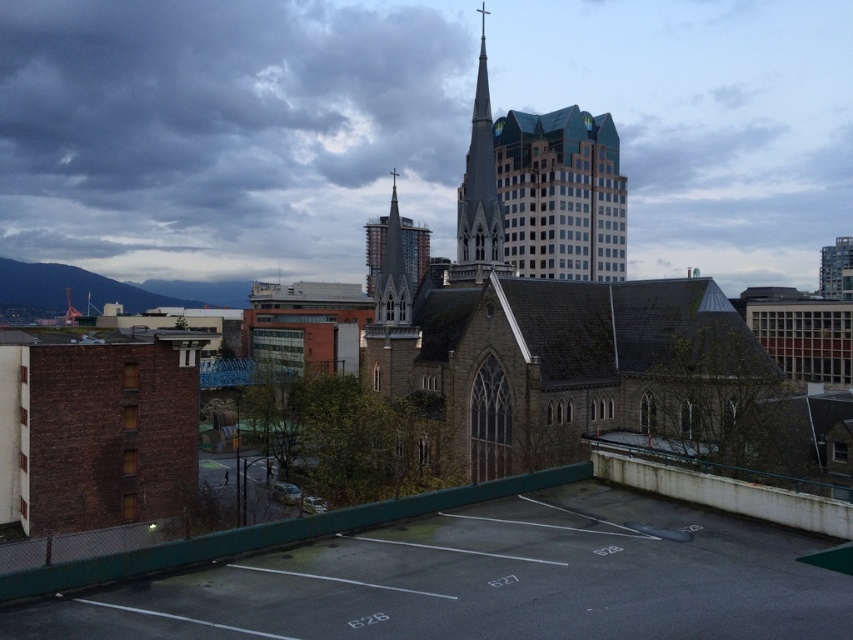
You are a city planner assessing the space between two structures in the image. The gray stone spire at center and the dark gray stone tower at center are both part of the church complex. You need to install a temporary walkway between them for maintenance. The walkway requires a minimum clearance of 100 feet between the two structures. Based on the scene description, will the existing space between them allow for this installation?

The gray stone spire at center is 100.75 feet from the dark gray stone tower at center. Since the required clearance is 100 feet, the existing space of 100.75 feet is sufficient to accommodate the temporary walkway between them.

You are standing at the center of the parking lot and want to take a photo of the gray stone spire at center. Which direction should you face to capture it in your camera view?

You should face towards the center of the scene to capture the gray stone spire at center, as it is located at point coordinates of (479, 193).